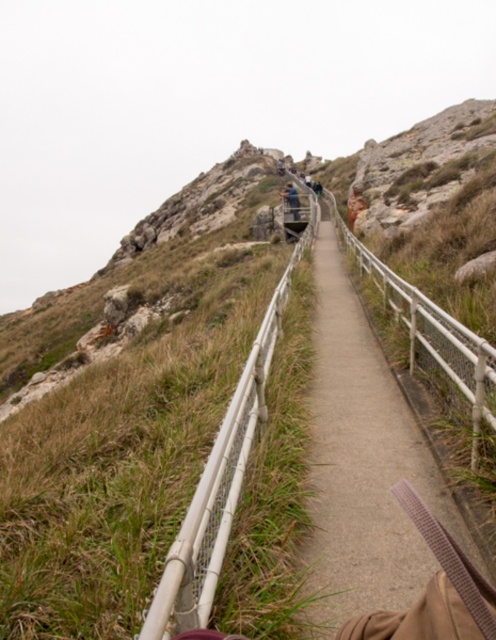
Is point (399, 397) in front of point (287, 195)?

Yes, it is in front of point (287, 195).

Between point (333, 529) and point (288, 200), which one is positioned in front?

Positioned in front is point (333, 529).

At what (x,y) coordinates should I click in order to perform the action: click on smooth concrete path at center. Please return your answer as a coordinate pair (x, y). Looking at the image, I should click on (362, 464).